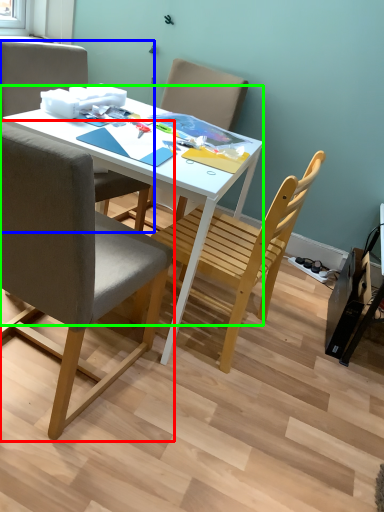
Question: Which is nearer to the chair (highlighted by a red box)? chair (highlighted by a blue box) or desk (highlighted by a green box).

Choices:
 (A) chair
 (B) desk

Answer: (B)